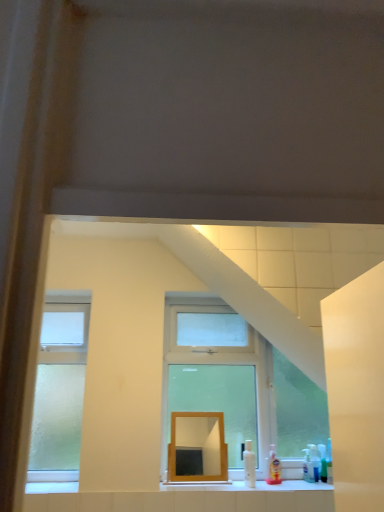
Question: From a real-world perspective, is translucent plastic soap dispenser at lower right, marked as the 1th toiletry in a left-to-right arrangement, located beneath translucent plastic spray bottle at lower right, the 1th toiletry in the right-to-left sequence?

Choices:
 (A) no
 (B) yes

Answer: (A)

Question: From the image's perspective, is translucent plastic soap dispenser at lower right, positioned as the second toiletry in right-to-left order, located above translucent plastic spray bottle at lower right, arranged as the second toiletry when viewed from the left?

Choices:
 (A) yes
 (B) no

Answer: (A)

Question: Is translucent plastic spray bottle at lower right, the 1th toiletry in the right-to-left sequence, inside translucent plastic soap dispenser at lower right, positioned as the second toiletry in right-to-left order?

Choices:
 (A) yes
 (B) no

Answer: (B)

Question: Are translucent plastic soap dispenser at lower right, marked as the 1th toiletry in a left-to-right arrangement, and translucent plastic spray bottle at lower right, the 1th toiletry in the right-to-left sequence, far apart?

Choices:
 (A) yes
 (B) no

Answer: (B)

Question: Does translucent plastic soap dispenser at lower right, positioned as the second toiletry in right-to-left order, have a greater width compared to translucent plastic spray bottle at lower right, the 1th toiletry in the right-to-left sequence?

Choices:
 (A) yes
 (B) no

Answer: (A)

Question: Can you confirm if translucent plastic soap dispenser at lower right, marked as the 1th toiletry in a left-to-right arrangement, is bigger than translucent plastic spray bottle at lower right, the 1th toiletry in the right-to-left sequence?

Choices:
 (A) yes
 (B) no

Answer: (A)

Question: Considering the relative positions of clear glass window at center and wooden mirror at center in the image provided, is clear glass window at center to the right of wooden mirror at center from the viewer's perspective?

Choices:
 (A) no
 (B) yes

Answer: (B)

Question: Does clear glass window at center have a lesser width compared to wooden mirror at center?

Choices:
 (A) yes
 (B) no

Answer: (B)

Question: Does clear glass window at center have a smaller size compared to wooden mirror at center?

Choices:
 (A) no
 (B) yes

Answer: (A)

Question: From the image's perspective, is clear glass window at center on wooden mirror at center?

Choices:
 (A) yes
 (B) no

Answer: (A)

Question: Is clear glass window at center positioned beyond the bounds of wooden mirror at center?

Choices:
 (A) yes
 (B) no

Answer: (A)

Question: Is clear glass window at center positioned far away from wooden mirror at center?

Choices:
 (A) yes
 (B) no

Answer: (B)

Question: Is translucent plastic spray bottle at lower right, the 1th toiletry in the right-to-left sequence, located within clear glass window at center?

Choices:
 (A) no
 (B) yes

Answer: (B)